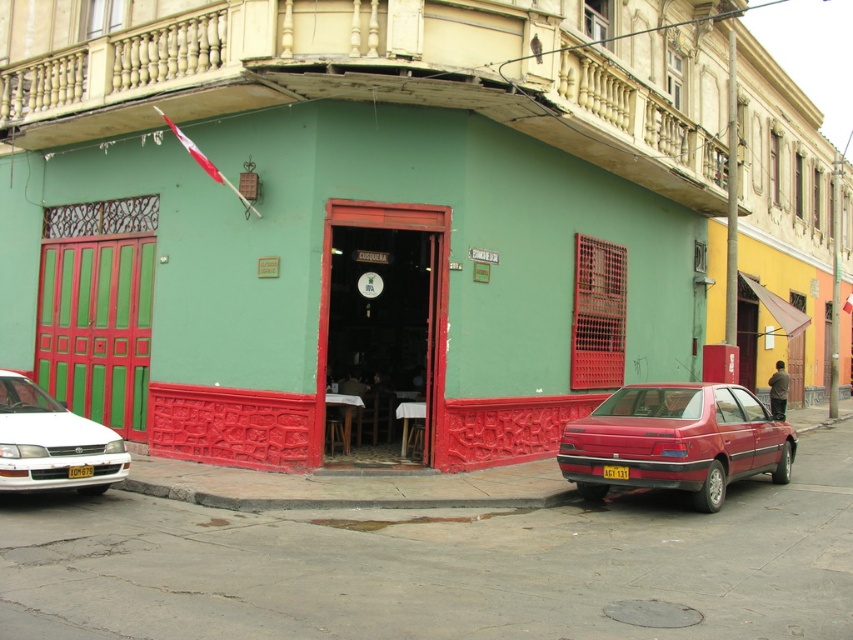
The height and width of the screenshot is (640, 853). What do you see at coordinates (51, 442) in the screenshot?
I see `white glossy sedan at left` at bounding box center [51, 442].

Between white glossy sedan at left and yellow metallic license plate at center, which one has more height?

With more height is white glossy sedan at left.

Between point (114, 432) and point (74, 476), which one is positioned behind?

Positioned behind is point (114, 432).

You are a GUI agent. You are given a task and a screenshot of the screen. Output one action in this format:
    pyautogui.click(x=<x>, y=<y>)
    Task: Click on the white glossy sedan at left
    The width and height of the screenshot is (853, 640).
    Given the screenshot: What is the action you would take?
    pyautogui.click(x=51, y=442)

Is white glossy sedan at left wider than yellow matte license plate at center?

Indeed, white glossy sedan at left has a greater width compared to yellow matte license plate at center.

Between point (97, 435) and point (618, 467), which one is positioned behind?

The point (618, 467) is behind.

I want to click on white glossy sedan at left, so click(x=51, y=442).

Does glossy red car at lower right have a smaller size compared to white glossy sedan at left?

Actually, glossy red car at lower right might be larger than white glossy sedan at left.

Is glossy red car at lower right closer to the viewer compared to white glossy sedan at left?

No, it is behind white glossy sedan at left.

Is point (651, 388) more distant than point (45, 465)?

Yes, point (651, 388) is farther from viewer.

The height and width of the screenshot is (640, 853). Find the location of `glossy red car at lower right`. glossy red car at lower right is located at coordinates (676, 442).